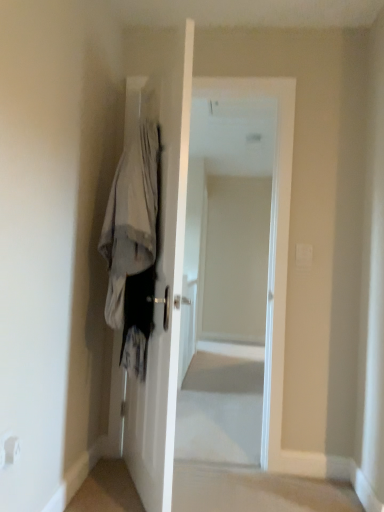
Question: Would you say white glossy door at center is outside white fabric coat at left?

Choices:
 (A) yes
 (B) no

Answer: (A)

Question: Can you confirm if white glossy door at center is positioned to the right of white fabric coat at left?

Choices:
 (A) no
 (B) yes

Answer: (B)

Question: Is white glossy door at center next to white fabric coat at left and touching it?

Choices:
 (A) no
 (B) yes

Answer: (A)

Question: From the image's perspective, is white glossy door at center beneath white fabric coat at left?

Choices:
 (A) yes
 (B) no

Answer: (A)

Question: Does white glossy door at center turn towards white fabric coat at left?

Choices:
 (A) no
 (B) yes

Answer: (B)

Question: Considering the relative sizes of white glossy door at center and white fabric coat at left in the image provided, is white glossy door at center smaller than white fabric coat at left?

Choices:
 (A) yes
 (B) no

Answer: (B)

Question: Does white glossy door at center lie behind white glossy door at center?

Choices:
 (A) yes
 (B) no

Answer: (B)

Question: Can you see white glossy door at center touching white glossy door at center?

Choices:
 (A) no
 (B) yes

Answer: (A)

Question: From a real-world perspective, is white glossy door at center under white glossy door at center?

Choices:
 (A) yes
 (B) no

Answer: (A)

Question: Can you confirm if white glossy door at center is wider than white glossy door at center?

Choices:
 (A) yes
 (B) no

Answer: (B)

Question: From a real-world perspective, does white glossy door at center stand above white glossy door at center?

Choices:
 (A) yes
 (B) no

Answer: (B)

Question: From the image's perspective, does white glossy door at center appear lower than white glossy door at center?

Choices:
 (A) yes
 (B) no

Answer: (A)

Question: From a real-world perspective, is white fabric coat at left beneath white glossy door at center?

Choices:
 (A) no
 (B) yes

Answer: (A)